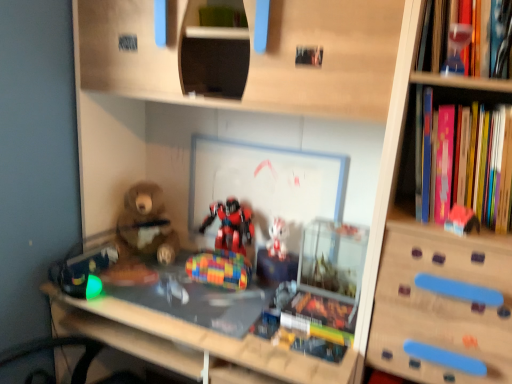
What are the coordinates of `free space above hardcover book at center, which is the 1th book in left-to-right order (from a real-world perspective)` in the screenshot? It's located at (326, 318).